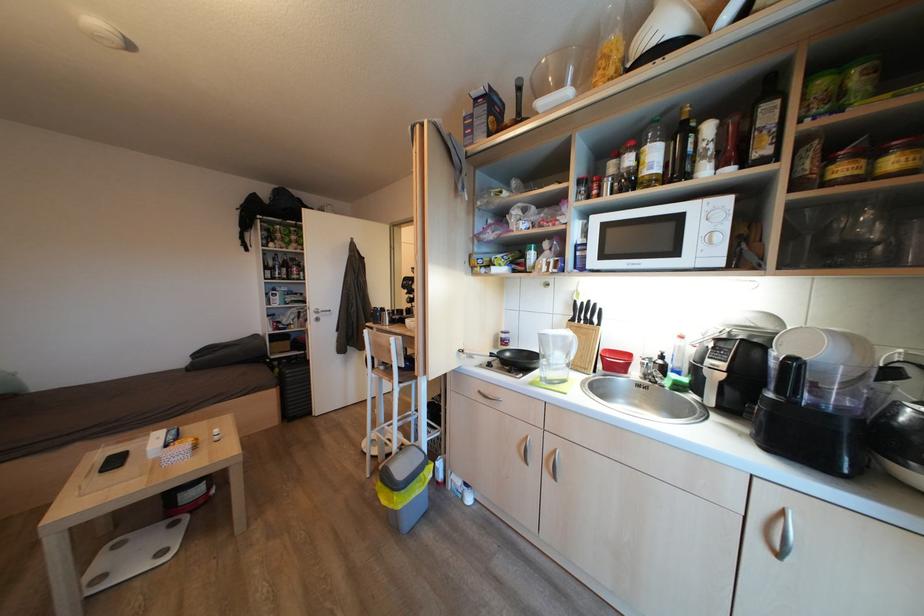
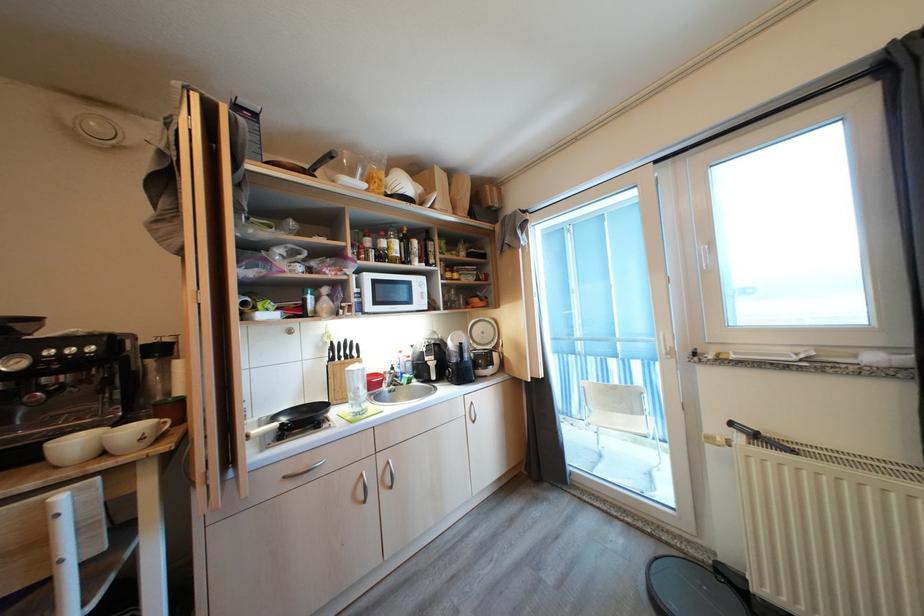
In the second image, find the point that corresponds to point 600,309 in the first image.

(357, 346)